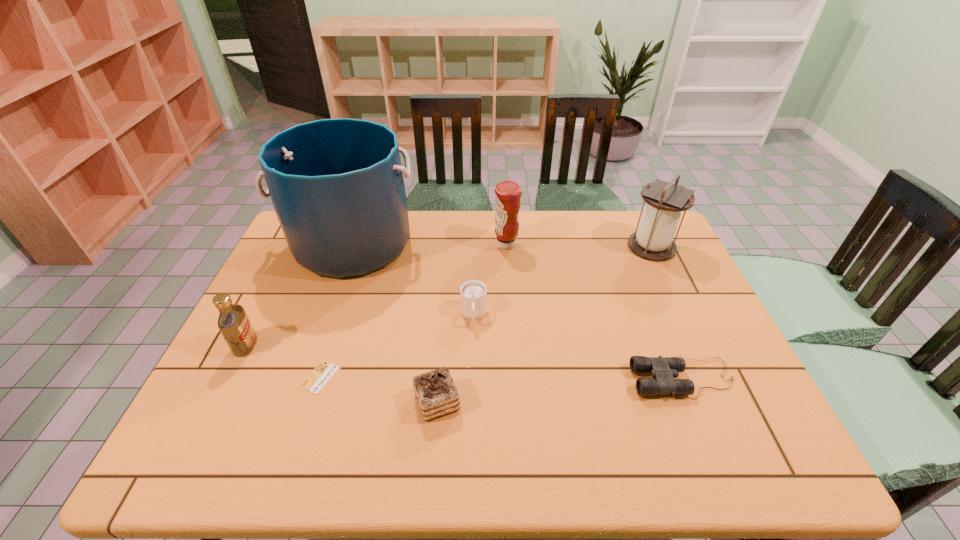
Identify the location of bucket. (337, 187).

I want to click on lantern, so click(x=653, y=239).

You are a GUI agent. You are given a task and a screenshot of the screen. Output one action in this format:
    pyautogui.click(x=<x>, y=<y>)
    Task: Click on the condiment
    The height and width of the screenshot is (540, 960).
    Given the screenshot: What is the action you would take?
    pyautogui.click(x=508, y=193)

Identify the location of the fifth farthest object. (233, 322).

Locate an element on the screen. The width and height of the screenshot is (960, 540). vodka is located at coordinates (233, 322).

Where is `the fifth nearest object`? The image size is (960, 540). the fifth nearest object is located at coordinates (473, 293).

The width and height of the screenshot is (960, 540). Identify the location of chocolate cake. (436, 393).

Locate an element on the screen. the seventh tallest object is located at coordinates (663, 370).

Locate an element on the screen. The width and height of the screenshot is (960, 540). identity card is located at coordinates (319, 378).

The height and width of the screenshot is (540, 960). In order to click on vacant space positioned on the right of the tallest object in this screenshot , I will do `click(461, 244)`.